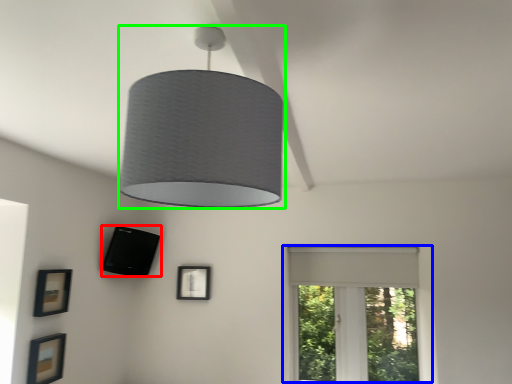
Question: Which object is positioned farthest from picture frame (highlighted by a red box)? Select from window (highlighted by a blue box) and lamp (highlighted by a green box).

Choices:
 (A) window
 (B) lamp

Answer: (B)